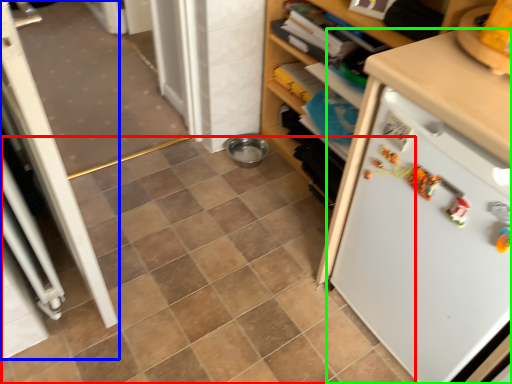
Question: Estimate the real-world distances between objects in this image. Which object is closer to ceramic tile (highlighted by a red box), screen door (highlighted by a blue box) or refrigerator (highlighted by a green box)?

Choices:
 (A) screen door
 (B) refrigerator

Answer: (A)